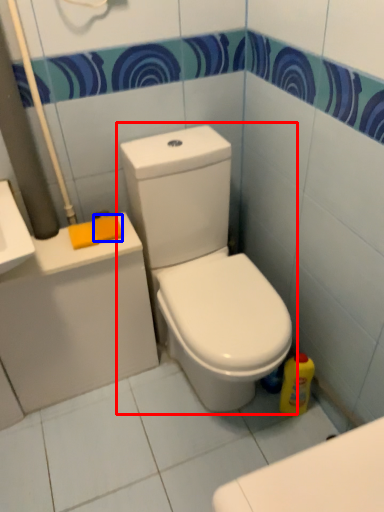
Question: Which point is further to the camera, toilet (highlighted by a red box) or soap (highlighted by a blue box)?

Choices:
 (A) toilet
 (B) soap

Answer: (B)